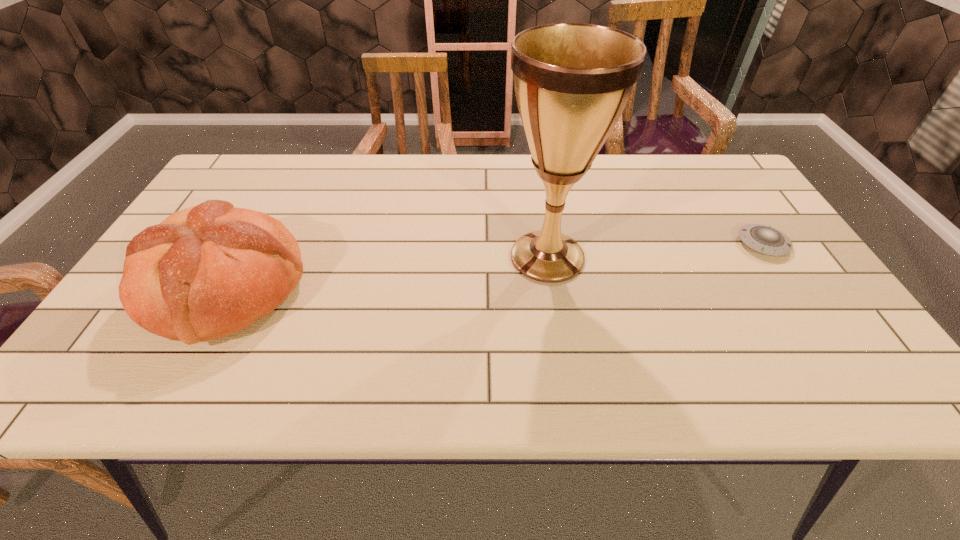
Where is `free space between the leftmost object and the saucer`? The height and width of the screenshot is (540, 960). free space between the leftmost object and the saucer is located at coordinates (494, 266).

The height and width of the screenshot is (540, 960). I want to click on free point between the second object from right to left and the rightmost object, so click(655, 251).

Where is `free spot between the tallest object and the rightmost object`? The height and width of the screenshot is (540, 960). free spot between the tallest object and the rightmost object is located at coordinates (655, 251).

At what (x,y) coordinates should I click in order to perform the action: click on vacant space that is in between the second shortest object and the tallest object. Please return your answer as a coordinate pair (x, y). The width and height of the screenshot is (960, 540). Looking at the image, I should click on point(387,273).

Where is `vacant point located between the leftmost object and the tallest object`? vacant point located between the leftmost object and the tallest object is located at coordinates (387, 273).

Identify the location of free space between the saucer and the second shortest object. The width and height of the screenshot is (960, 540). (494, 266).

This screenshot has height=540, width=960. What are the coordinates of `unoccupied position between the rightmost object and the bread` in the screenshot? It's located at (494, 266).

Point out which object is positioned as the second nearest to the shortest object. Please provide its 2D coordinates. Your answer should be formatted as a tuple, i.e. [(x, y)], where the tuple contains the x and y coordinates of a point satisfying the conditions above.

[(208, 271)]

The width and height of the screenshot is (960, 540). I want to click on object that is the second closest to the bread, so click(x=764, y=239).

Locate an element on the screen. The image size is (960, 540). free spot that satisfies the following two spatial constraints: 1. on the back side of the second shortest object; 2. on the left side of the saucer is located at coordinates (251, 244).